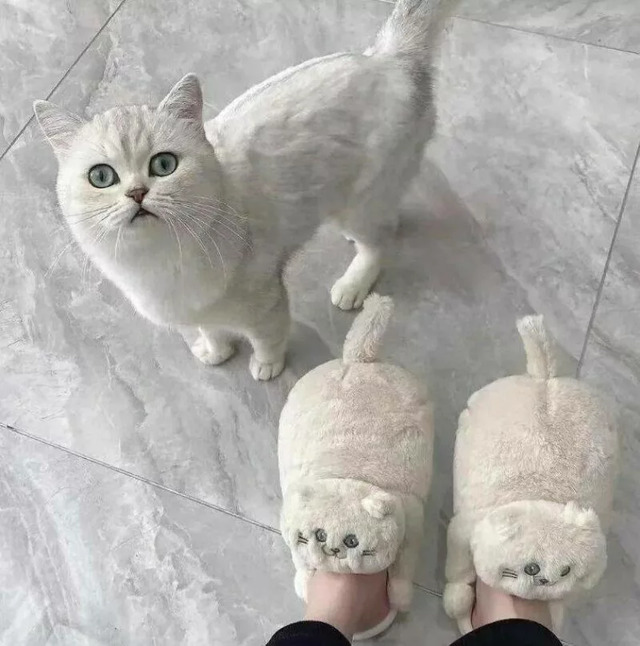
Where is `fake cat tail on slippers`? The width and height of the screenshot is (640, 646). fake cat tail on slippers is located at coordinates (381, 340), (534, 351).